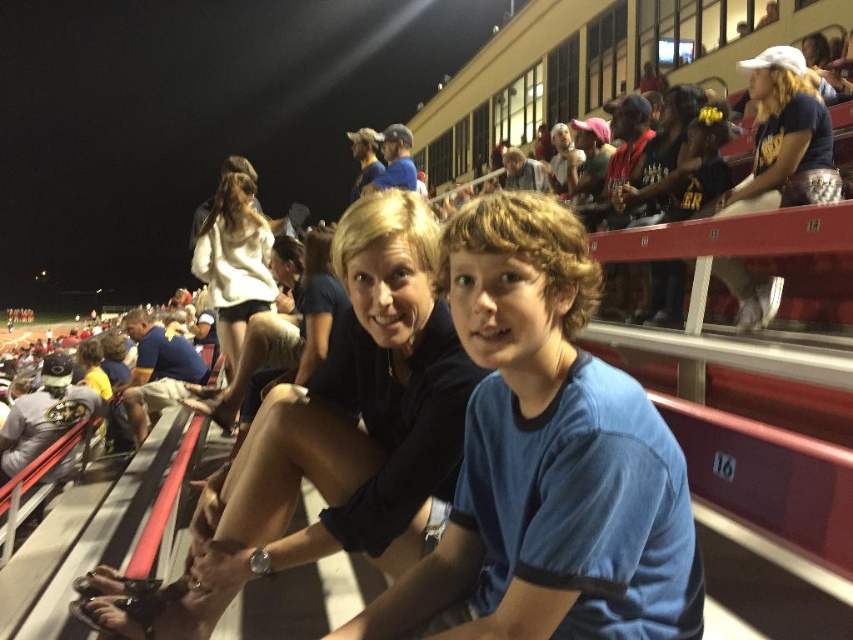
Can you confirm if white matte baseball cap at upper right is thinner than white soft sweater at upper center?

Yes, white matte baseball cap at upper right is thinner than white soft sweater at upper center.

Between point (807, 177) and point (212, 304), which one is positioned behind?

The point (212, 304) is more distant.

The width and height of the screenshot is (853, 640). What do you see at coordinates (784, 138) in the screenshot? I see `white matte baseball cap at upper right` at bounding box center [784, 138].

Identify the location of white matte baseball cap at upper right. (784, 138).

Which is below, blue cotton shirt at center or matte black shirt at center?

Result: Positioned lower is matte black shirt at center.

Is point (570, 436) more distant than point (282, 486)?

No, it is not.

The height and width of the screenshot is (640, 853). Identify the location of blue cotton shirt at center. (546, 460).

Is blue cotton shirt at center taller than white matte baseball cap at upper right?

Indeed, blue cotton shirt at center has a greater height compared to white matte baseball cap at upper right.

Based on the photo, who is lower down, blue cotton shirt at center or white matte baseball cap at upper right?

Positioned lower is blue cotton shirt at center.

You are a GUI agent. You are given a task and a screenshot of the screen. Output one action in this format:
    pyautogui.click(x=<x>, y=<y>)
    Task: Click on the blue cotton shirt at center
    Image resolution: width=853 pixels, height=640 pixels.
    Given the screenshot: What is the action you would take?
    pyautogui.click(x=546, y=460)